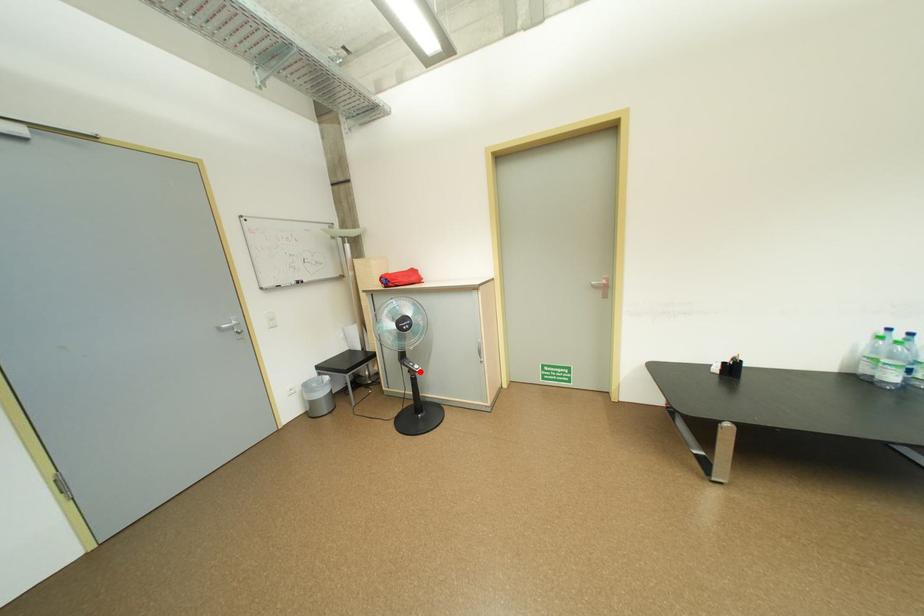
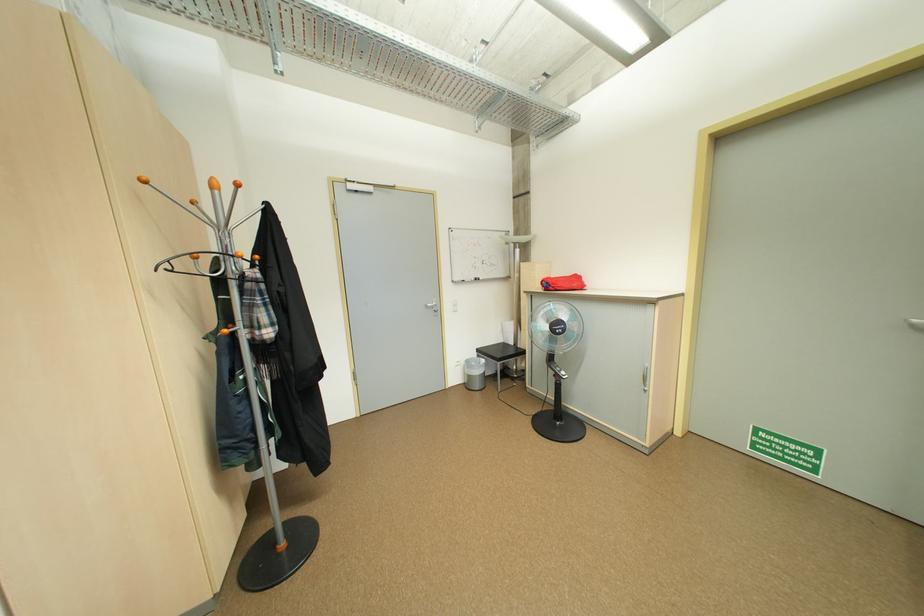
Question: I am providing you with two images of the same scene from different viewpoints. In image1, a red point is highlighted. Considering the same 3D point in image2, which of the following is correct?

Choices:
 (A) It is closer
 (B) It is farther

Answer: (A)